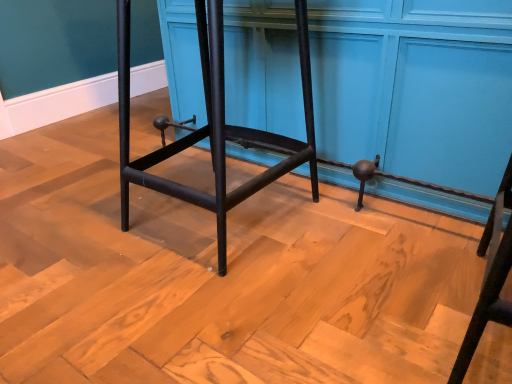
This screenshot has width=512, height=384. What are the coordinates of `vacant space to the right of black metal stool at center` in the screenshot? It's located at (366, 246).